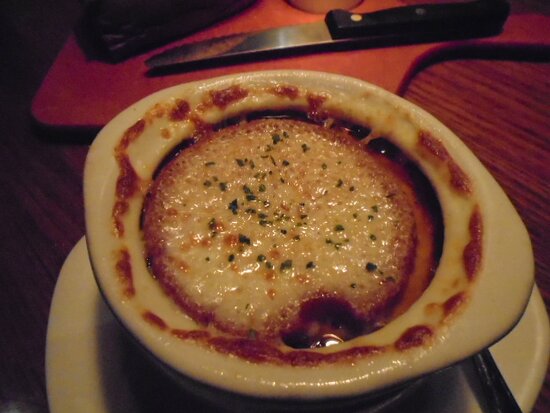
What are the coordinates of `cutting board` in the screenshot? It's located at (88, 98).